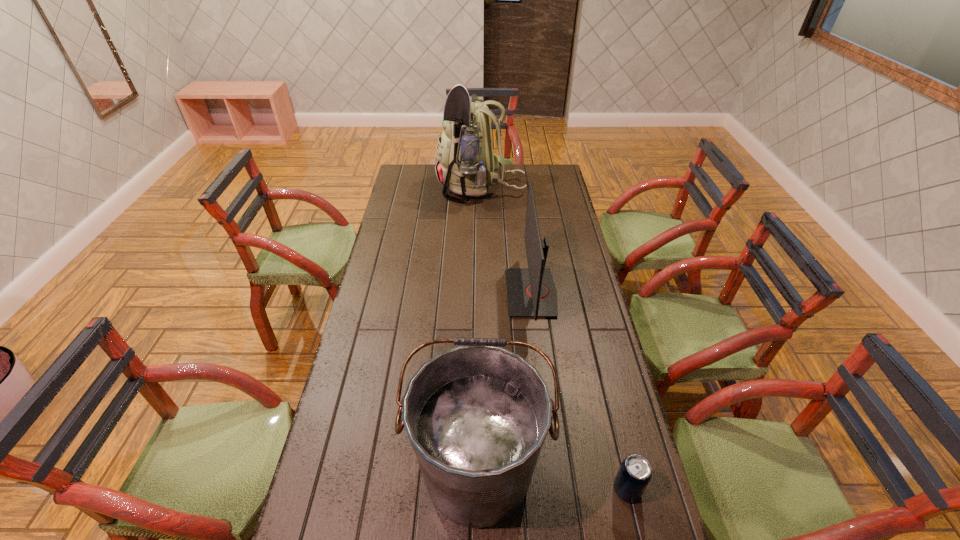
What are the coordinates of `vacant region located on the screen side of the second farthest object` in the screenshot? It's located at (482, 293).

This screenshot has height=540, width=960. What are the coordinates of `free space located on the left of the rightmost object` in the screenshot? It's located at click(x=514, y=490).

Find the location of `object that is at the far edge`. object that is at the far edge is located at coordinates (466, 163).

What are the coordinates of `monitor present at the right edge` in the screenshot? It's located at (531, 292).

Where is `soda can located in the right edge section of the desktop`? This screenshot has height=540, width=960. soda can located in the right edge section of the desktop is located at coordinates (634, 474).

Where is `free space at the left edge of the desktop`? free space at the left edge of the desktop is located at coordinates (303, 523).

Identify the location of blank space at the right edge of the desktop. This screenshot has height=540, width=960. (592, 328).

This screenshot has width=960, height=540. Identify the location of blank area at the far left corner. (414, 177).

You are a GUI agent. You are given a task and a screenshot of the screen. Output one action in this format:
    pyautogui.click(x=<x>, y=<y>)
    Task: Click on the free point between the farthest object and the rightmost object
    The height and width of the screenshot is (540, 960).
    Given the screenshot: What is the action you would take?
    pyautogui.click(x=554, y=339)

Find the location of a particular element. This screenshot has height=540, width=960. vacant space that is in between the backpack and the soda can is located at coordinates (554, 339).